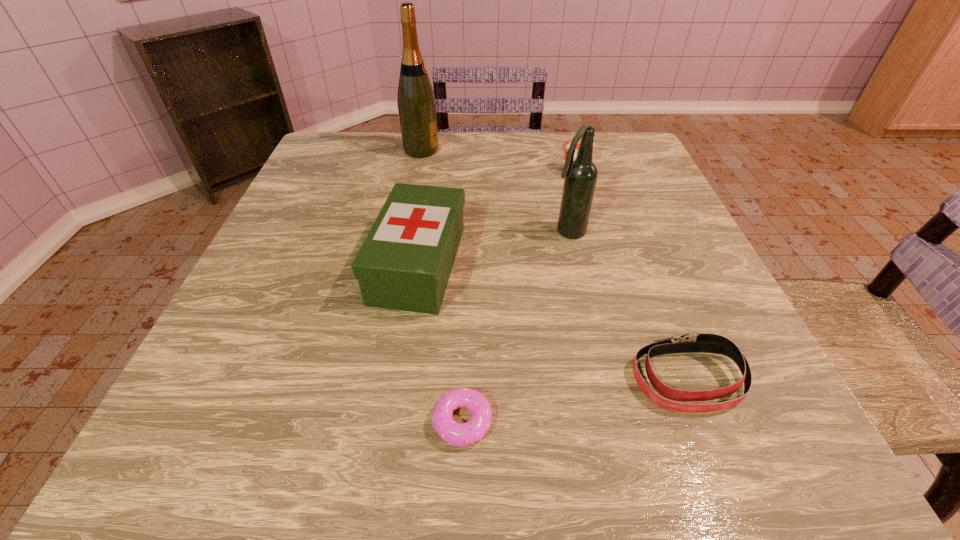
In order to click on object present at the near right corner in this screenshot , I will do `click(690, 342)`.

Find the location of a particular element. The width and height of the screenshot is (960, 540). vacant region at the far edge of the desktop is located at coordinates (479, 134).

In the image, there is a desktop. Where is `vacant space at the near edge`? This screenshot has height=540, width=960. vacant space at the near edge is located at coordinates (492, 470).

Where is `vacant area at the left edge`? The image size is (960, 540). vacant area at the left edge is located at coordinates (296, 213).

Where is `vacant space at the right edge`? Image resolution: width=960 pixels, height=540 pixels. vacant space at the right edge is located at coordinates (659, 328).

Identify the location of vacant space at the far left corner of the desktop. The width and height of the screenshot is (960, 540). (380, 137).

In the image, there is a desktop. At what (x,y) coordinates should I click in order to perform the action: click on vacant space at the far right corner. Please return your answer as a coordinate pair (x, y). Looking at the image, I should click on (631, 150).

Where is `vacant area between the doughnut and the fifth shortest object`? The width and height of the screenshot is (960, 540). vacant area between the doughnut and the fifth shortest object is located at coordinates (516, 327).

The image size is (960, 540). In order to click on vacant space in between the alarm clock and the farthest object in this screenshot , I will do `click(498, 159)`.

At what (x,y) coordinates should I click in order to perform the action: click on vacant area that lies between the tallest object and the alarm clock. Please return your answer as a coordinate pair (x, y). This screenshot has height=540, width=960. Looking at the image, I should click on (498, 159).